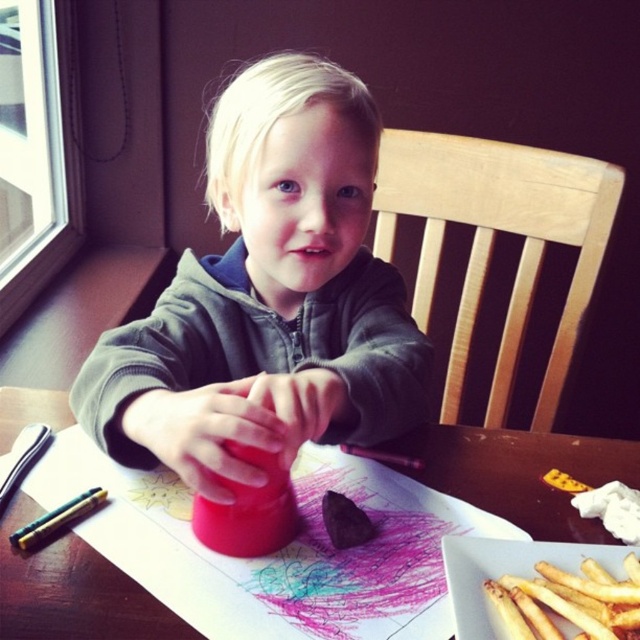
Is point (353, 104) closer to viewer compared to point (77, 497)?

No, (353, 104) is behind (77, 497).

Is point (278, 432) behind point (48, 529)?

That is False.

Is point (240, 365) in front of point (22, 547)?

No, it is behind (22, 547).

At what (x,y) coordinates should I click in order to perform the action: click on matte plastic cup at center. Please return your answer as a coordinate pair (x, y). Looking at the image, I should click on (268, 298).

Does white crispy fries at lower right appear on the left side of metallic silver pencil at lower left?

Incorrect, white crispy fries at lower right is not on the left side of metallic silver pencil at lower left.

You are a GUI agent. You are given a task and a screenshot of the screen. Output one action in this format:
    pyautogui.click(x=<x>, y=<y>)
    Task: Click on the white crispy fries at lower right
    This screenshot has height=640, width=640.
    Given the screenshot: What is the action you would take?
    pyautogui.click(x=570, y=602)

Locate an element on the screen. The width and height of the screenshot is (640, 640). white crispy fries at lower right is located at coordinates (570, 602).

Which is in front, point (248, 262) or point (49, 596)?

Point (49, 596)

Between matte plastic cup at center and matte plastic table at center, which one appears on the left side from the viewer's perspective?

Positioned to the left is matte plastic cup at center.

Find the location of a particular element. Image resolution: width=640 pixels, height=640 pixels. matte plastic cup at center is located at coordinates (268, 298).